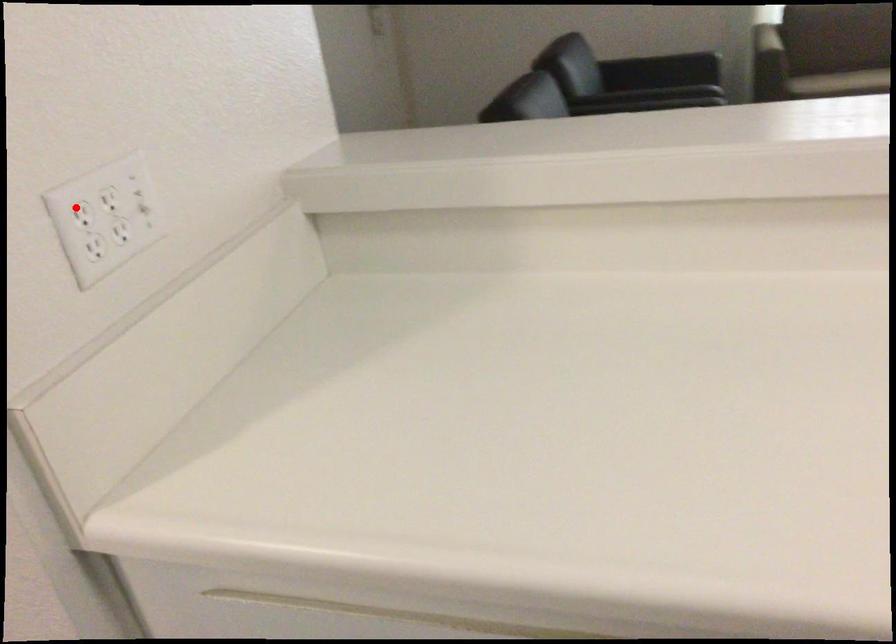
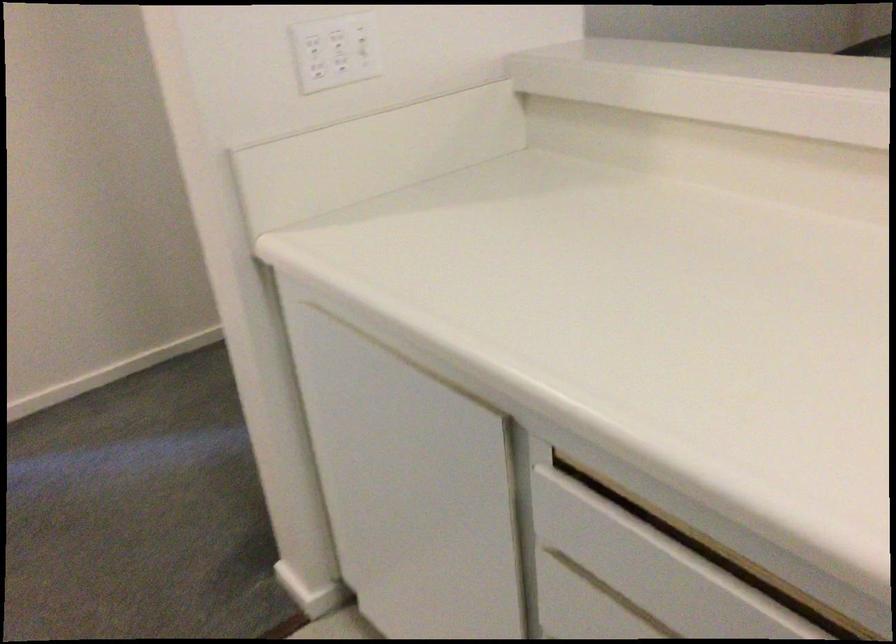
Locate, in the second image, the point that corresponds to the highlighted location in the first image.

(309, 39)